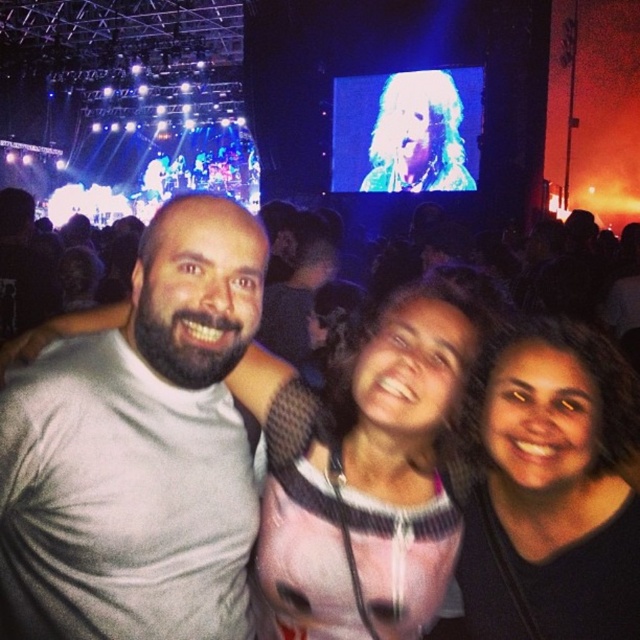
You are taking a selfie with three friends at a concert. You notice the pink mesh top at center and the dark hair at center. Which one is more to the left?

The pink mesh top at center is more to the left because it is positioned on the left side of dark hair at center.

In the scene shown: You are at a concert and want to take a selfie with the man on the left. The point where you should aim your camera to focus on his gray matte t shirt is located at coordinates point (x=138, y=451). Is this point on the gray matte t shirt at left?

Yes, the point (x=138, y=451) is on the gray matte t shirt at left according to the description.